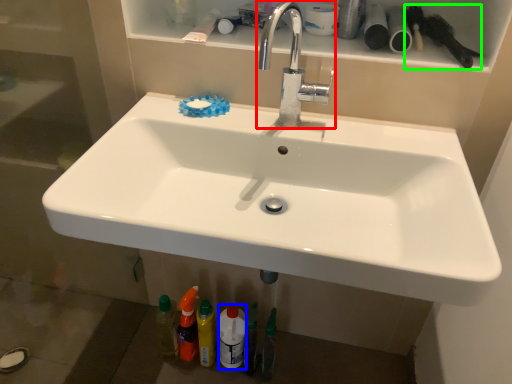
Question: Based on their relative distances, which object is farther from tap (highlighted by a red box)? Choose from mouthwash (highlighted by a blue box) and brush (highlighted by a green box).

Choices:
 (A) mouthwash
 (B) brush

Answer: (A)